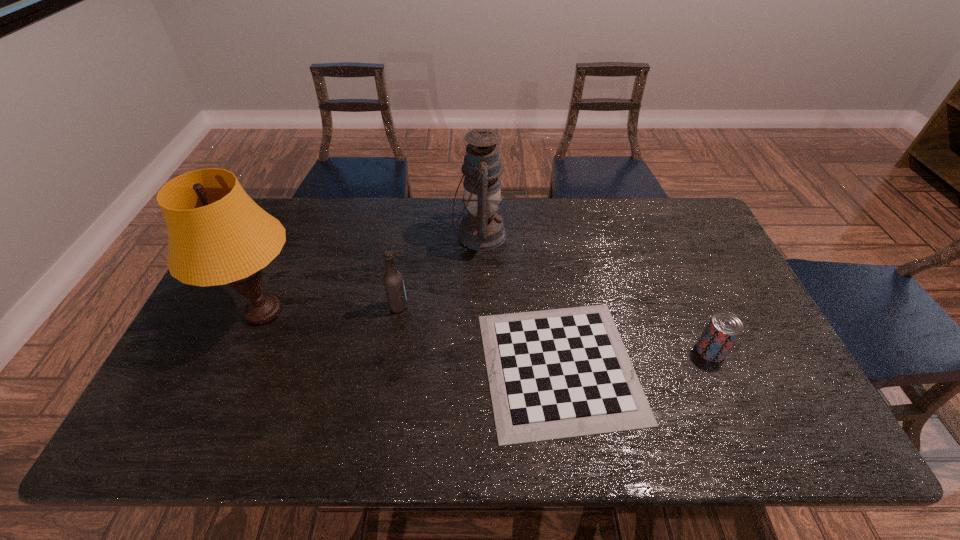
Image resolution: width=960 pixels, height=540 pixels. In order to click on blank space at the far right corner of the desktop in this screenshot , I will do `click(672, 218)`.

Where is `vacant area that lies between the oil lamp and the third tallest object`? This screenshot has width=960, height=540. vacant area that lies between the oil lamp and the third tallest object is located at coordinates (439, 271).

Locate an element on the screen. free space that is in between the oil lamp and the second object from left to right is located at coordinates (439, 271).

Where is `unoccupied area between the shortest object and the second shortest object`? The width and height of the screenshot is (960, 540). unoccupied area between the shortest object and the second shortest object is located at coordinates (636, 359).

Identify the location of vacant area between the beer bottle and the lampshade. click(331, 309).

You are a GUI agent. You are given a task and a screenshot of the screen. Output one action in this format:
    pyautogui.click(x=<x>, y=<y>)
    Task: Click on the free area in between the shortest object and the oil lamp
    
    Given the screenshot: What is the action you would take?
    pyautogui.click(x=519, y=301)

Where is `free space between the shortest object and the farthest object`? The width and height of the screenshot is (960, 540). free space between the shortest object and the farthest object is located at coordinates (519, 301).

Where is `free space between the shortest object and the second object from left to right`? This screenshot has width=960, height=540. free space between the shortest object and the second object from left to right is located at coordinates (479, 336).

Locate an element on the screen. This screenshot has width=960, height=540. the third closest object to the beer can is located at coordinates (393, 281).

Identify which object is located as the fourth nearest to the leftmost object. Please provide its 2D coordinates. Your answer should be formatted as a tuple, i.e. [(x, y)], where the tuple contains the x and y coordinates of a point satisfying the conditions above.

[(724, 328)]